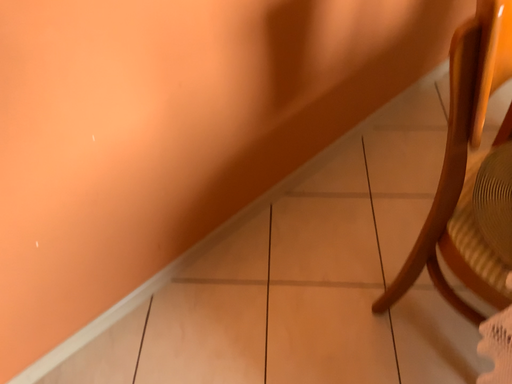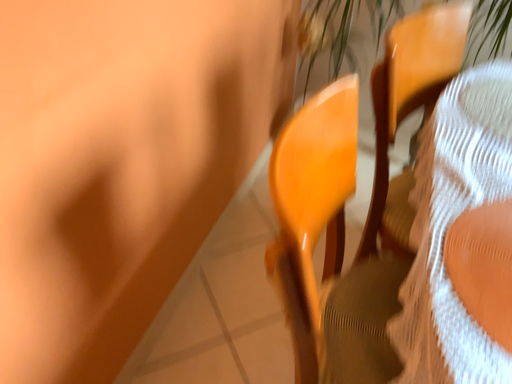
Question: Which way did the camera rotate in the video?

Choices:
 (A) rotated right
 (B) rotated left

Answer: (A)